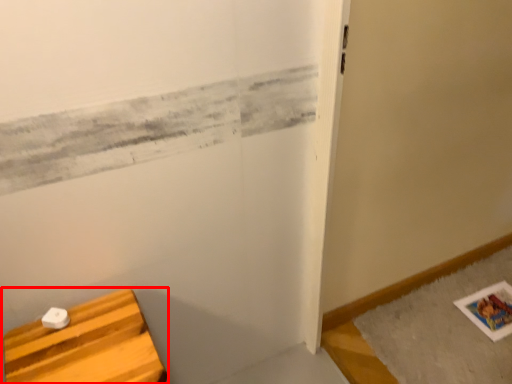
Question: In this image, where is furniture (annotated by the red box) located relative to bath mat?

Choices:
 (A) left
 (B) right

Answer: (A)